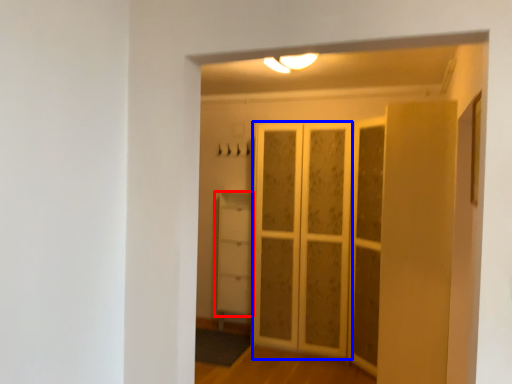
Question: Which of the following is the farthest to the observer, cupboard (highlighted by a red box) or screen door (highlighted by a blue box)?

Choices:
 (A) cupboard
 (B) screen door

Answer: (A)